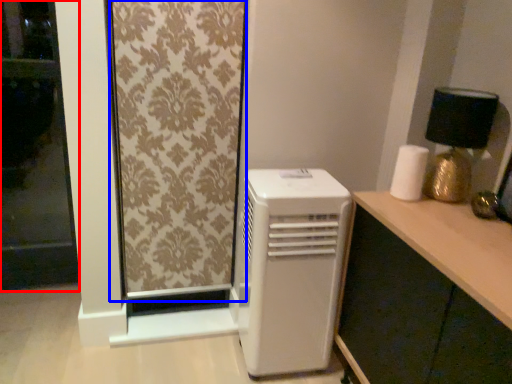
Question: Among these objects, which one is nearest to the camera, screen door (highlighted by a red box) or curtain (highlighted by a blue box)?

Choices:
 (A) screen door
 (B) curtain

Answer: (B)